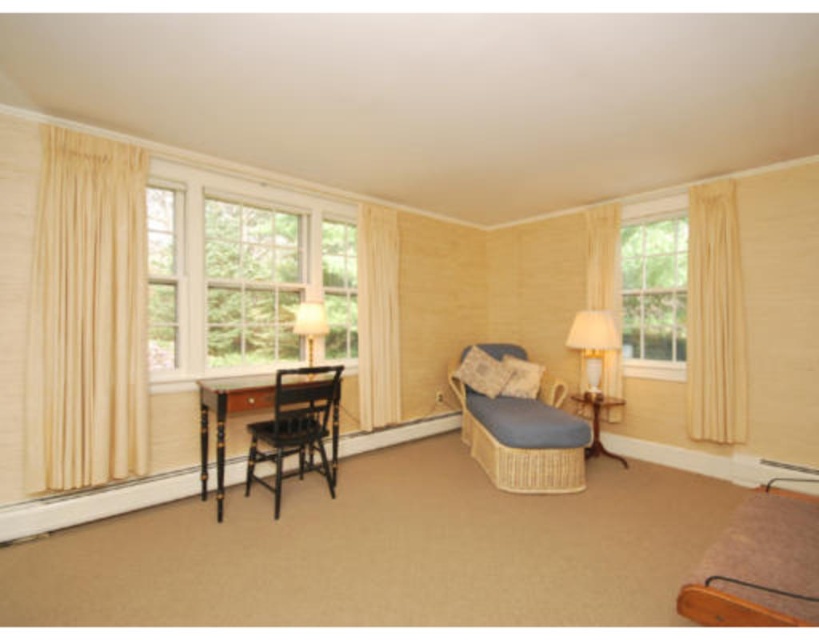
From the picture: You are organizing a small event in the room and need to place a decorative item on the table next to the white glossy table lamp at right. However, you want to ensure that the decorative item won not block the view of the beige fabric curtain at center. Can you do this?

The beige fabric curtain at center is above the white glossy table lamp at right, so placing the decorative item on the table next to the white glossy table lamp at right will not block the view of the beige fabric curtain at center since it is positioned higher up.

You are organizing a small party in the room and want to place a decorative banner that is 1 meter wide between the sheer yellow curtain at right and the white glossy lampshade at upper center. Considering their widths, will the banner fit between them?

The sheer yellow curtain at right is narrower than the white glossy lampshade at upper center, so the banner may not fit between them since the total available space might be insufficient.

From the picture: You are standing in the center of the room. Which object is located at the point with coordinates (378, 316)?

The beige fabric curtain at center is located at the point with coordinates (378, 316).